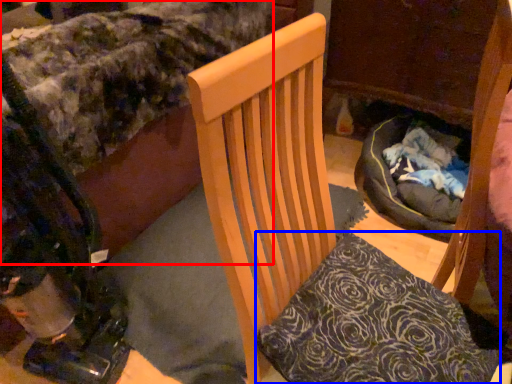
Question: Which of the following is the farthest to the observer, bed (highlighted by a red box) or pillow (highlighted by a blue box)?

Choices:
 (A) bed
 (B) pillow

Answer: (A)